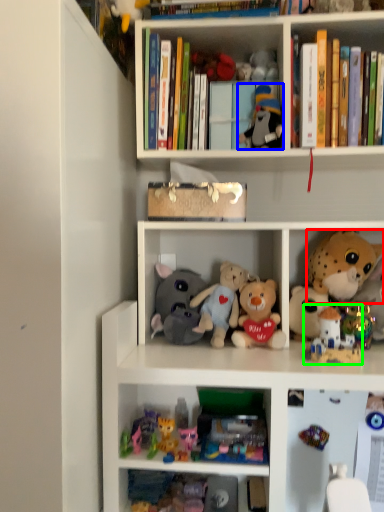
Question: Considering the real-world distances, which object is closest to toy (highlighted by a red box)? toy (highlighted by a blue box) or toy (highlighted by a green box).

Choices:
 (A) toy
 (B) toy

Answer: (B)